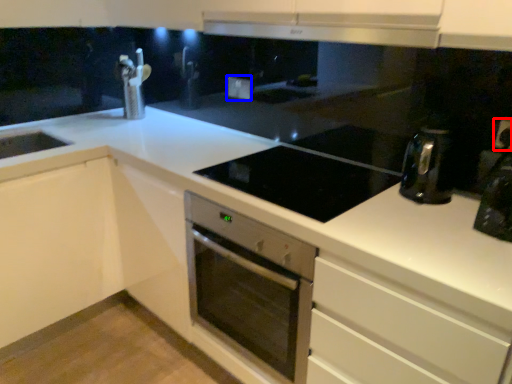
Question: Which object appears closest to the camera in this image, electric outlet (highlighted by a red box) or electric outlet (highlighted by a blue box)?

Choices:
 (A) electric outlet
 (B) electric outlet

Answer: (A)